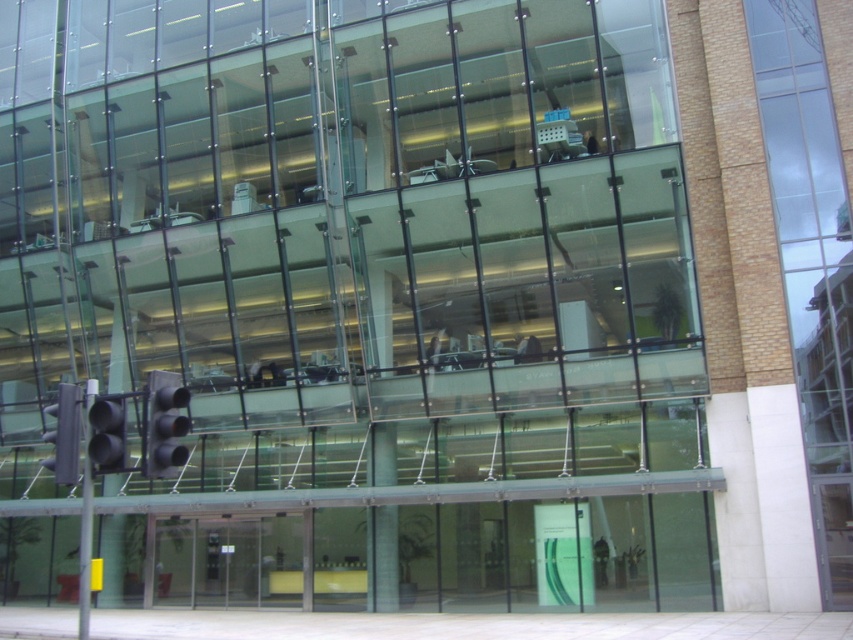
Question: Which of the following is the farthest from the observer?

Choices:
 (A) black matte traffic light at lower left
 (B) clear glass window at right
 (C) gray metallic traffic light at lower left

Answer: (B)

Question: Can you confirm if gray metallic traffic light at lower left is thinner than matte black traffic light at lower left?

Choices:
 (A) yes
 (B) no

Answer: (B)

Question: Does clear glass window at right have a smaller size compared to metallic silver car at center?

Choices:
 (A) yes
 (B) no

Answer: (B)

Question: Which point is farther to the camera?

Choices:
 (A) clear glass window at right
 (B) black matte traffic light at lower left
 (C) gray metallic traffic light at lower left

Answer: (A)

Question: Which of these objects is positioned farthest from the clear glass window at right?

Choices:
 (A) matte black traffic light at lower left
 (B) metallic silver car at center

Answer: (B)

Question: Can you confirm if black matte traffic light at lower left is thinner than gray metallic traffic light at lower left?

Choices:
 (A) no
 (B) yes

Answer: (B)